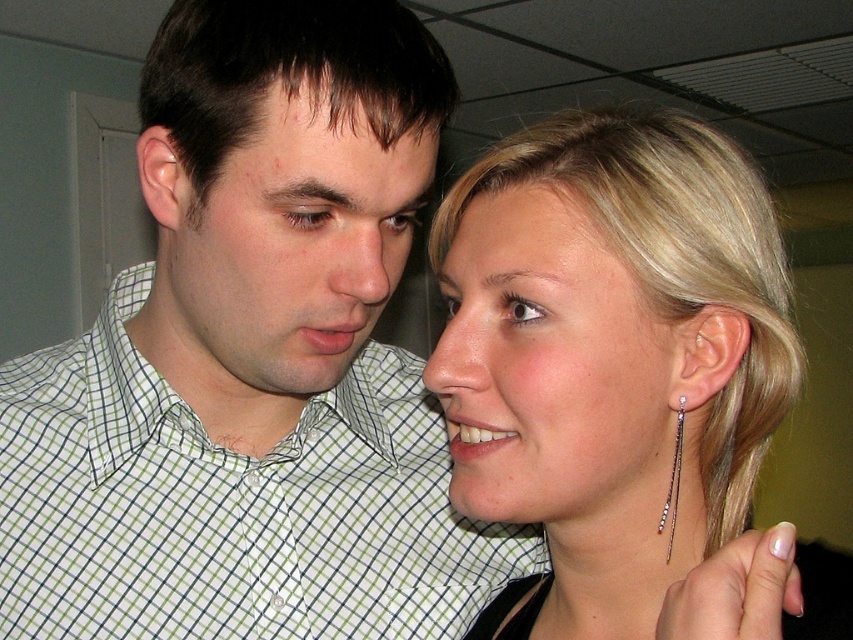
You are an artist sketching the scene and need to determine the placement of the sleek silver earrings at upper right and the matte skin at upper center. Based on their positions, which object is located below the other?

The sleek silver earrings at upper right is positioned under matte skin at upper center, so the earrings are below the matte skin.

You are a photographer adjusting the focus of your camera. You need to focus on the pale skin at center and matte skin at upper center. Which one is closer to the camera?

The pale skin at center is closer to the camera than the matte skin at upper center because it is 12.96 centimeters away from it.